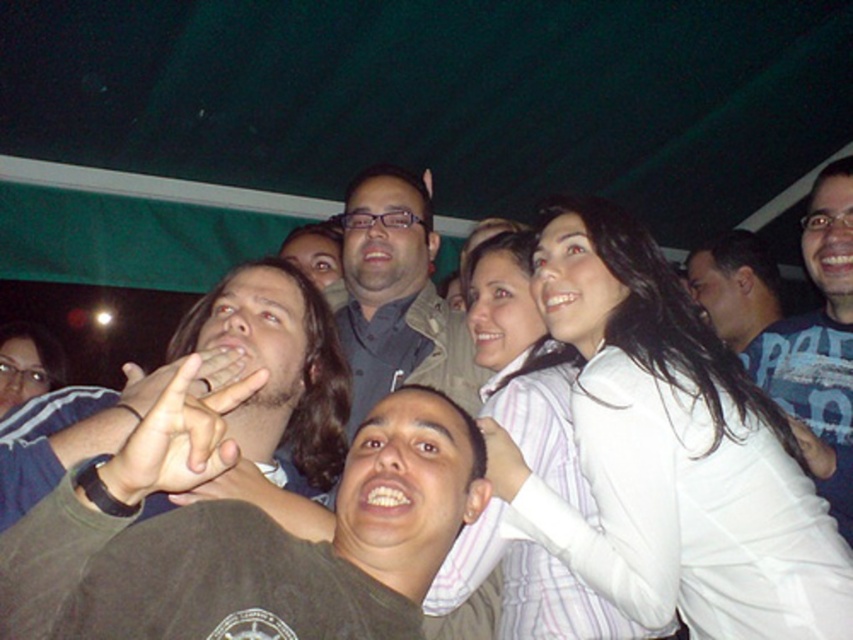
You are organizing a photo album and want to place the white striped shirt at upper right and the blue shirt at upper right in a row. If you want to arrange them from largest to smallest, which should come first?

The white striped shirt at upper right should come first since it is bigger than the blue shirt at upper right.

You are organizing a photo album and want to ensure the brown leather hand at center and the blue shirt at upper right are both visible in the thumbnail. Since the thumbnail has limited space, which object should you prioritize to ensure it fits properly?

The brown leather hand at center occupies less space than the blue shirt at upper right, so it should be prioritized to ensure it fits properly in the thumbnail.

You are standing at the origin of the coordinate system in the image. The white striped shirt at upper right is located at point (x=671, y=452). Is the white striped shirt at upper right closer to the top edge or the right edge of the image?

The white striped shirt at upper right is closer to the right edge of the image because its x coordinate of 0.709 is closer to 1.0 than its y coordinate of 0.788 is to 1.0.